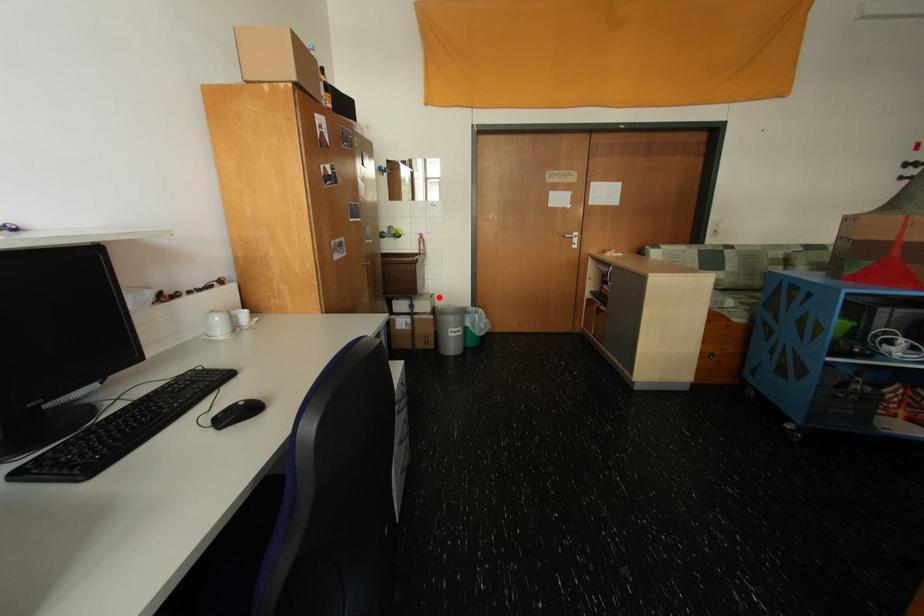
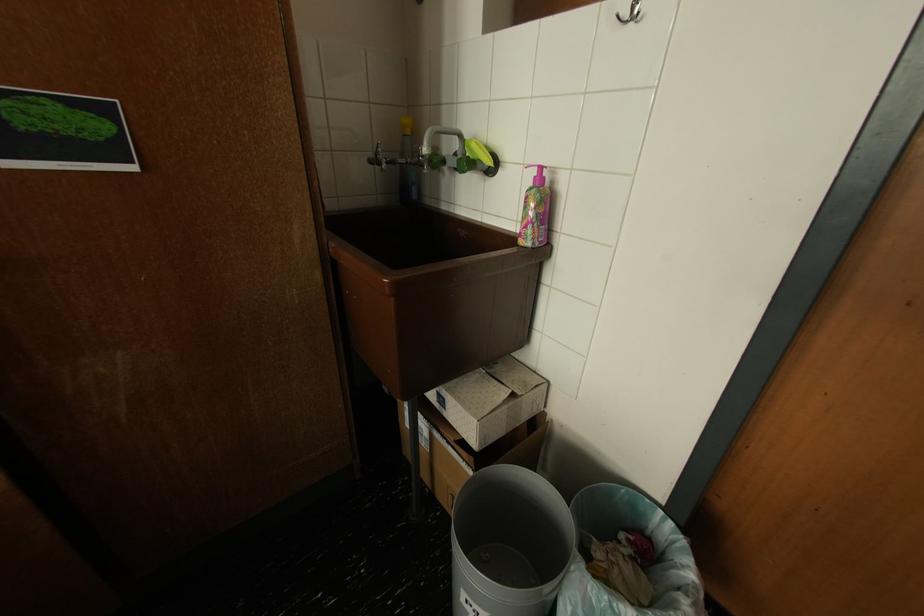
Question: I am providing you with two images of the same scene from different viewpoints. In image1, a red point is highlighted. Considering the same 3D point in image2, which of the following is correct?

Choices:
 (A) It is closer
 (B) It is farther

Answer: (B)